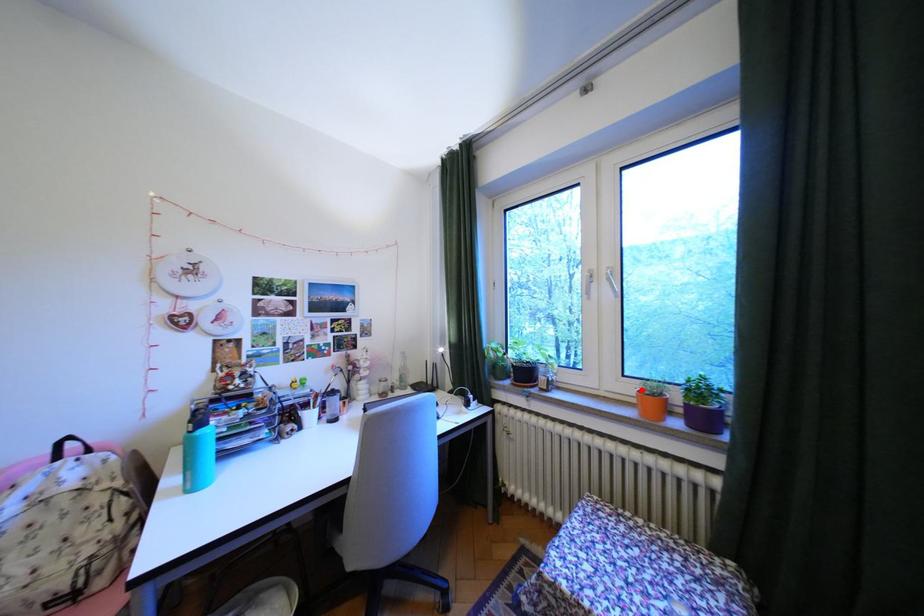
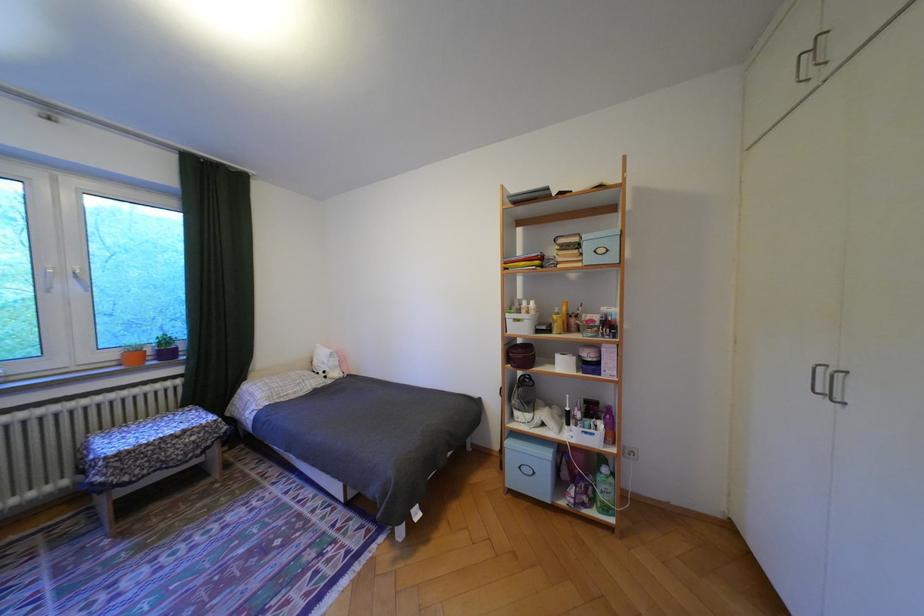
Question: I am providing you with two images of the same scene from different viewpoints. A red point is marked on the first image. Can you still see the location of the red point in image 2?

Choices:
 (A) Yes
 (B) No

Answer: (A)